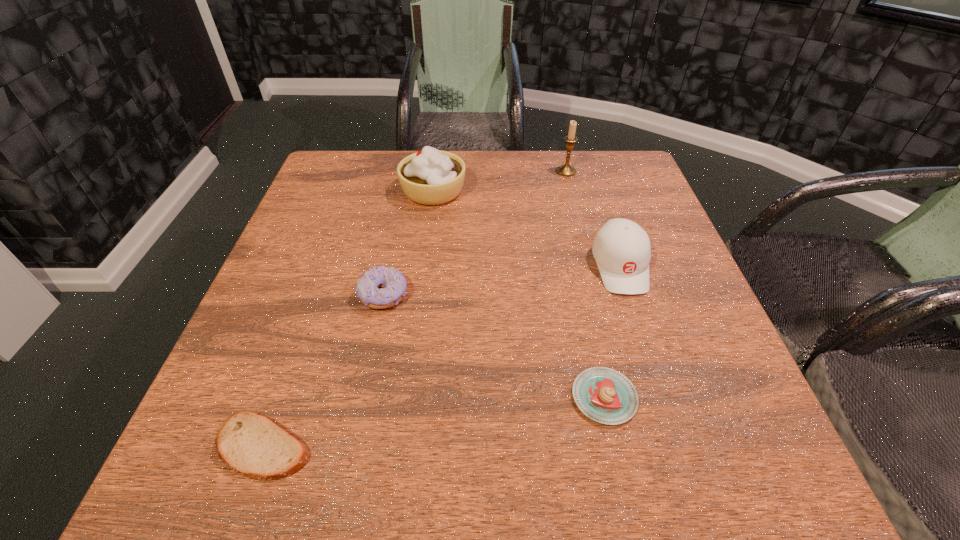
I want to click on vacant space that is in between the third tallest object and the second shortest object, so click(x=612, y=332).

Where is `vacant area that lies between the doughnut and the whipped cream`? This screenshot has height=540, width=960. vacant area that lies between the doughnut and the whipped cream is located at coordinates (408, 243).

Where is `vacant area that lies between the doughnut and the pastry`? The image size is (960, 540). vacant area that lies between the doughnut and the pastry is located at coordinates (493, 346).

Image resolution: width=960 pixels, height=540 pixels. Identify the location of free space between the shortest object and the third tallest object. (442, 356).

Where is `vacant region between the pita bread and the whipped cream`? vacant region between the pita bread and the whipped cream is located at coordinates (348, 319).

Identify which object is located as the fourth nearest to the fifth tallest object. Please provide its 2D coordinates. Your answer should be formatted as a tuple, i.e. [(x, y)], where the tuple contains the x and y coordinates of a point satisfying the conditions above.

[(430, 177)]

Where is `object that is the fifth closest to the fourth tallest object`? The image size is (960, 540). object that is the fifth closest to the fourth tallest object is located at coordinates (566, 170).

Find the location of `free location that satisfies the following two spatial constraints: 1. on the back side of the pita bread; 2. on the right side of the candle holder`. free location that satisfies the following two spatial constraints: 1. on the back side of the pita bread; 2. on the right side of the candle holder is located at coordinates (361, 171).

Identify the location of vacant space that satisfies the following two spatial constraints: 1. on the back side of the whipped cream; 2. on the right side of the candle holder. (436, 171).

This screenshot has width=960, height=540. What are the coordinates of `free point that satisfies the following two spatial constraints: 1. on the front side of the doughnut; 2. on the left side of the second shortest object` in the screenshot? It's located at (362, 397).